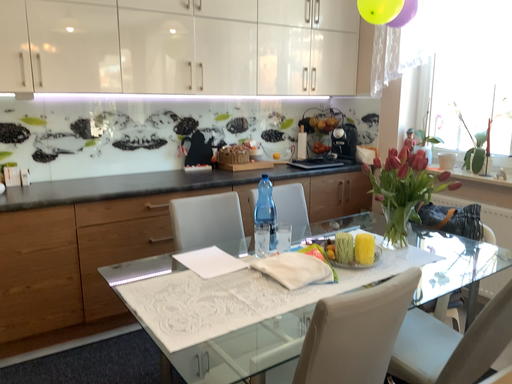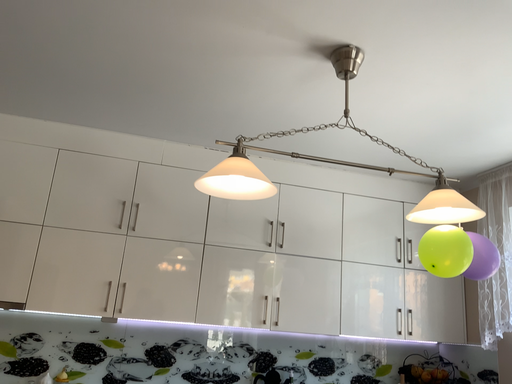
Question: Which way did the camera rotate in the video?

Choices:
 (A) rotated downward
 (B) rotated upward

Answer: (B)